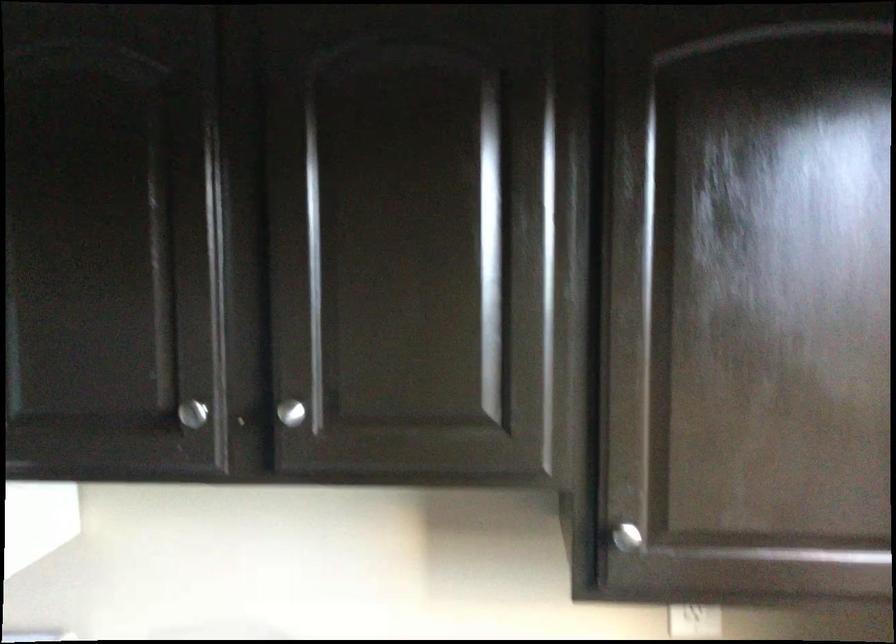
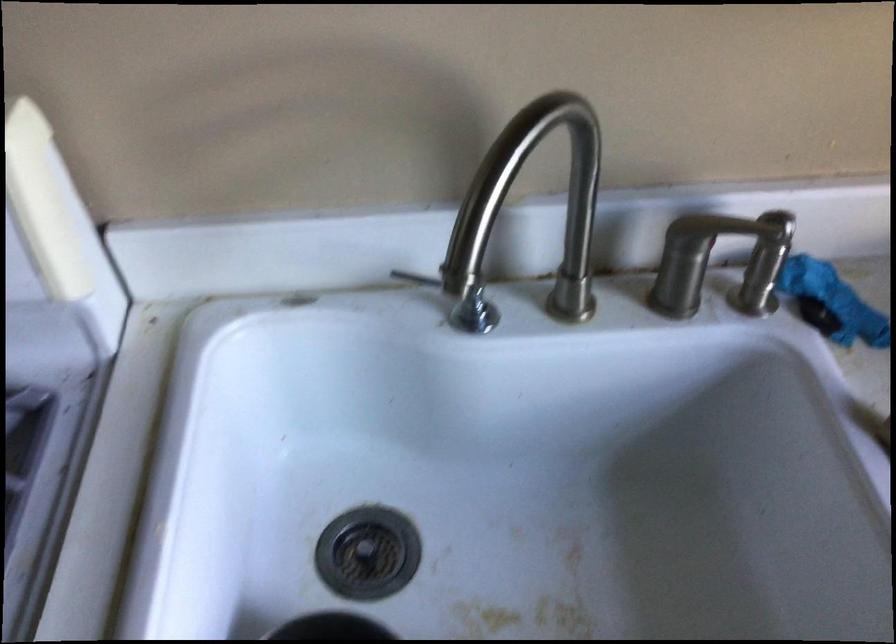
Question: The images are taken continuously from a first-person perspective. In which direction is your viewpoint rotating?

Choices:
 (A) Left
 (B) Right
 (C) Up
 (D) Down

Answer: (D)